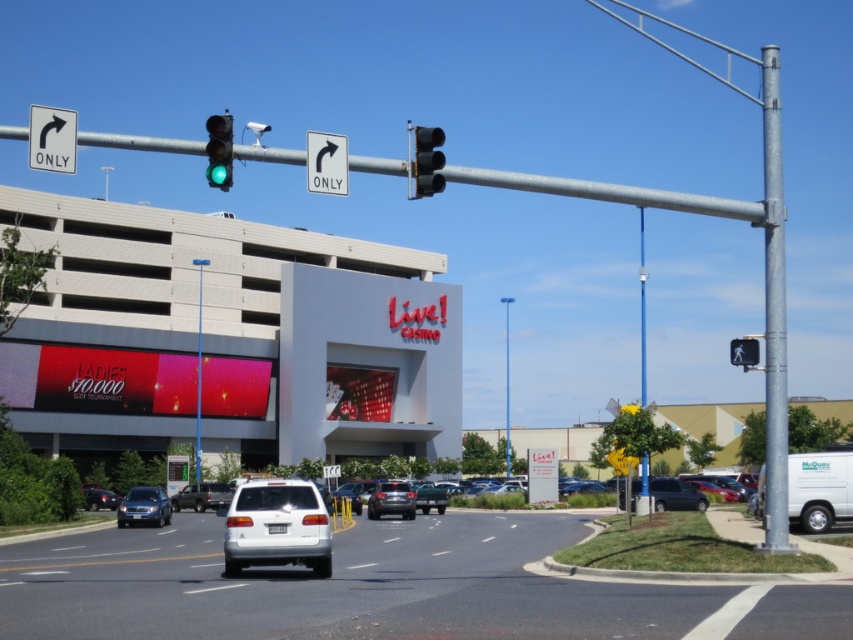
From the picture: You are a pedestrian waiting at the crosswalk. You want to cross the street to reach the casino entrance. There are two vehicles in the image, a dark gray metallic suv at lower right and a silver metallic sedan at center. Which vehicle should you wait for before proceeding to ensure safety?

You should wait until both the dark gray metallic suv at lower right and the silver metallic sedan at center have passed because the dark gray metallic suv at lower right is closer to the viewer and may reach the crosswalk sooner than the silver metallic sedan at center.

You are a delivery driver who needs to park your truck, which is 15 feet long, in the parking lot near the casino. The parking lot has spaces that can accommodate vehicles up to 14 feet in length. You see the dark gray metallic suv at lower right and the silver metallic sedan at center. Which vehicle, if either, would not fit in the parking spaces?

The dark gray metallic suv at lower right is bigger than the silver metallic sedan at center. Since the parking spaces can only accommodate vehicles up to 14 feet and the delivery truck is 15 feet long, neither vehicle would fit. However, the SUV is larger, so it would be the one that is more likely to exceed the space limit.